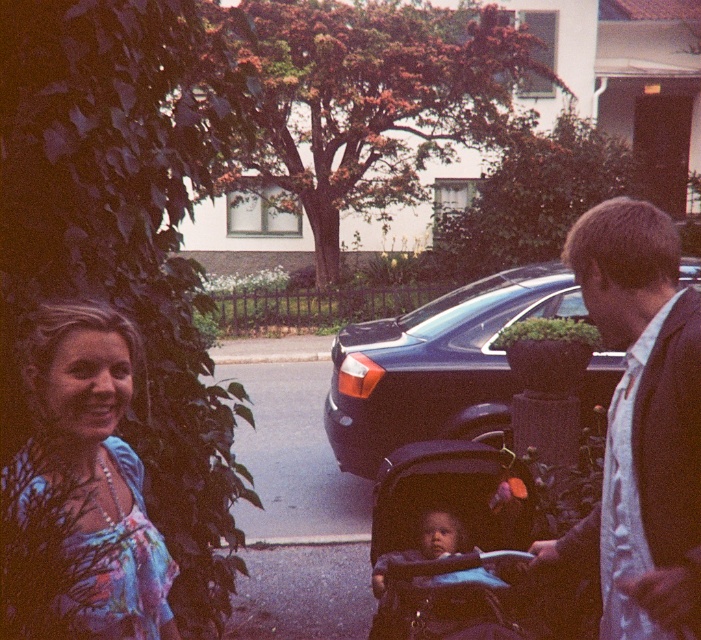
Who is more distant from viewer, (x=690, y=561) or (x=247, y=372)?

The point (x=247, y=372) is behind.

Between dark brown suit at right and black asphalt pavement at center, which one has more height?

Standing taller between the two is dark brown suit at right.

The width and height of the screenshot is (701, 640). What do you see at coordinates (641, 424) in the screenshot?
I see `dark brown suit at right` at bounding box center [641, 424].

Identify the location of dark brown suit at right. (641, 424).

Who is higher up, dark brown suit at right or shiny black car at center?

shiny black car at center is above.

From the picture: Does dark brown suit at right appear on the right side of shiny black car at center?

In fact, dark brown suit at right is to the left of shiny black car at center.

Does point (608, 406) lie in front of point (447, 408)?

Yes.

Identify the location of dark brown suit at right. (641, 424).

Who is shorter, dark blue fabric stroller at center or smooth blue baby carriage at center?

With less height is smooth blue baby carriage at center.

Does dark blue fabric stroller at center lie in front of smooth blue baby carriage at center?

Yes.

Who is more distant from viewer, (x=543, y=525) or (x=409, y=552)?

Point (x=543, y=525)

In order to click on dark blue fabric stroller at center in this screenshot , I will do `click(477, 545)`.